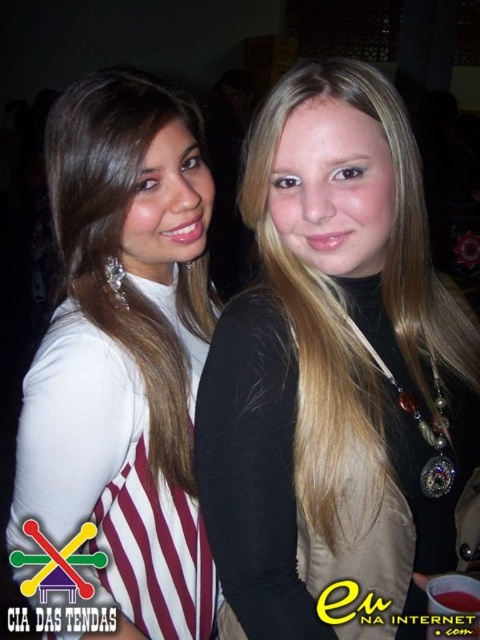
You are a photographer at a social event and need to capture a clear shot of both the black matte vest at center and the white matte dress at center. Since the vest is shorter, how should you adjust your camera angle to ensure both are fully visible in the frame?

To ensure both the black matte vest at center and the white matte dress at center are fully visible, position the camera slightly lower so the shorter vest remains in frame while accommodating the taller dress.

From the picture: You are a photographer at a social event. You want to capture a photo of both the black matte vest at center and the white matte dress at center in the same frame. The minimum distance between the two objects to ensure both are in focus is 25 centimeters. Can you take the photo with the current positioning?

The black matte vest at center is only 22.56 centimeters away from the white matte dress at center. Since the required minimum distance for both to be in focus is 25 centimeters, the current positioning is insufficient. You would need to adjust their positions to increase the distance between them to at least 25 centimeters to ensure both are in focus.

You are at a party and want to take a photo of the black matte vest at center and the white matte dress at center. Which one is positioned higher in the image?

The black matte vest at center is located above the white matte dress at center, so it is positioned higher in the image.